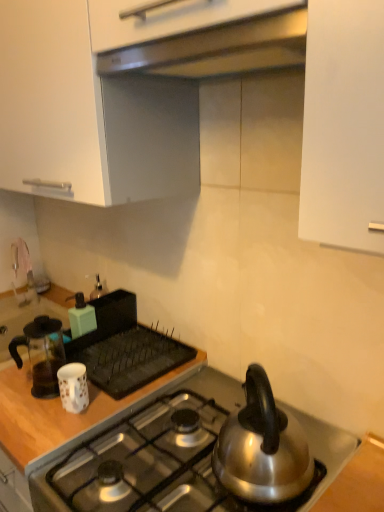
Where is `unoccupied space behind transparent glass coffee pot at left, the 2th kitchen appliance in the front-to-back sequence`? unoccupied space behind transparent glass coffee pot at left, the 2th kitchen appliance in the front-to-back sequence is located at coordinates (74, 355).